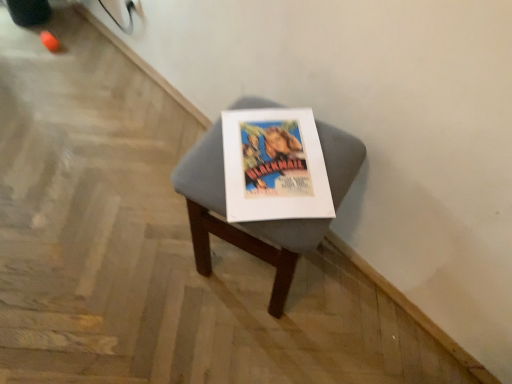
Question: Should I look upward or downward to see gray fabric stool at center?

Choices:
 (A) down
 (B) up

Answer: (A)

Question: Does matte paper poster at center have a lesser height compared to gray fabric stool at center?

Choices:
 (A) yes
 (B) no

Answer: (A)

Question: Does matte paper poster at center turn towards gray fabric stool at center?

Choices:
 (A) yes
 (B) no

Answer: (A)

Question: Can you confirm if matte paper poster at center is bigger than gray fabric stool at center?

Choices:
 (A) no
 (B) yes

Answer: (A)

Question: Is matte paper poster at center oriented away from gray fabric stool at center?

Choices:
 (A) yes
 (B) no

Answer: (A)

Question: Is matte paper poster at center located outside gray fabric stool at center?

Choices:
 (A) no
 (B) yes

Answer: (A)

Question: Can you confirm if matte paper poster at center is taller than gray fabric stool at center?

Choices:
 (A) yes
 (B) no

Answer: (B)

Question: Does gray fabric stool at center have a greater height compared to matte paper poster at center?

Choices:
 (A) yes
 (B) no

Answer: (A)

Question: Could you tell me if gray fabric stool at center is facing matte paper poster at center?

Choices:
 (A) no
 (B) yes

Answer: (A)

Question: Is matte paper poster at center at the back of gray fabric stool at center?

Choices:
 (A) yes
 (B) no

Answer: (B)

Question: Is gray fabric stool at center not inside matte paper poster at center?

Choices:
 (A) yes
 (B) no

Answer: (A)

Question: Considering the relative positions of gray fabric stool at center and matte paper poster at center in the image provided, is gray fabric stool at center to the left of matte paper poster at center from the viewer's perspective?

Choices:
 (A) yes
 (B) no

Answer: (A)

Question: From the image's perspective, would you say gray fabric stool at center is positioned over matte paper poster at center?

Choices:
 (A) no
 (B) yes

Answer: (A)

Question: Considering the positions of matte paper poster at center and gray fabric stool at center in the image, is matte paper poster at center wider or thinner than gray fabric stool at center?

Choices:
 (A) thin
 (B) wide

Answer: (A)